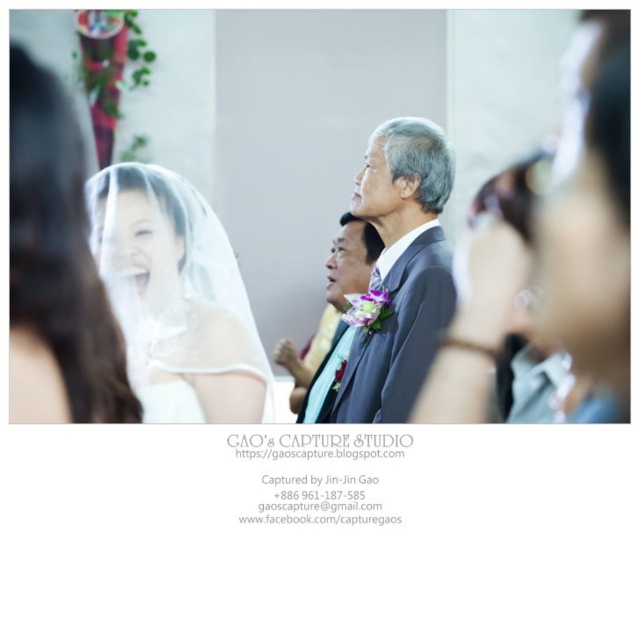
Is white satin veil at upper left below dark gray suit at center?

No, white satin veil at upper left is not below dark gray suit at center.

This screenshot has width=640, height=640. Identify the location of white satin veil at upper left. (358, 120).

What do you see at coordinates (177, 296) in the screenshot? I see `white sheer veil at upper left` at bounding box center [177, 296].

Between white sheer veil at upper left and white sheer veil at left, which one is positioned lower?

white sheer veil at upper left is lower down.

Is point (225, 262) positioned in front of point (45, 342)?

No.

Image resolution: width=640 pixels, height=640 pixels. What are the coordinates of `white sheer veil at upper left` in the screenshot? It's located at (177, 296).

Can you confirm if white satin veil at upper left is positioned to the left of white sheer veil at left?

No, white satin veil at upper left is not to the left of white sheer veil at left.

Does point (269, 312) come behind point (72, 328)?

That is True.

Locate an element on the screen. The image size is (640, 640). white satin veil at upper left is located at coordinates click(x=358, y=120).